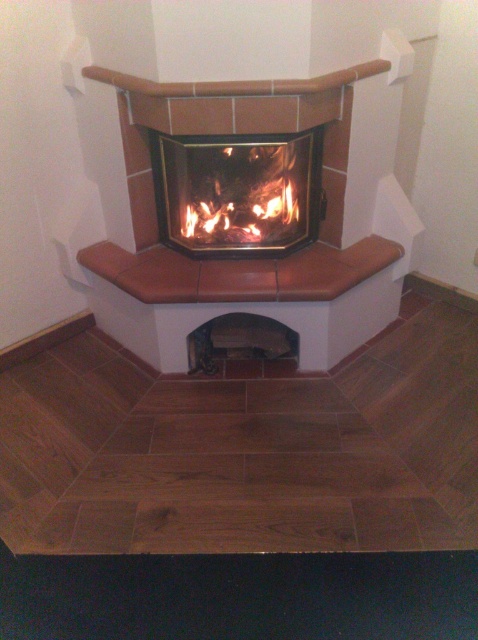
Between matte glass fireplace at center and orange wood fire at center, which one has less height?

orange wood fire at center is shorter.

Between point (246, 140) and point (253, 230), which one is positioned behind?

Positioned behind is point (253, 230).

Where is `matte glass fireplace at center`? The image size is (478, 640). matte glass fireplace at center is located at coordinates (238, 192).